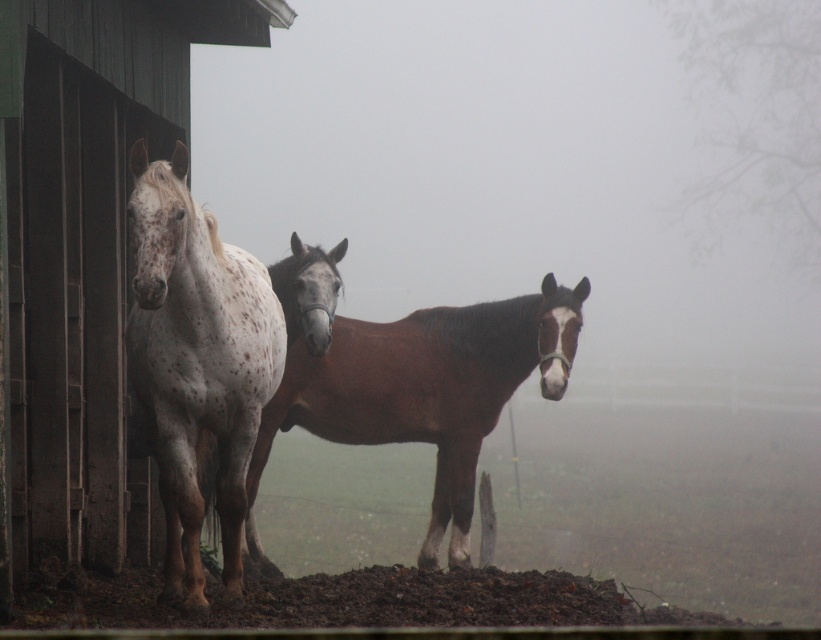
You are a farmer checking the weather conditions. You notice the speckled white horse at left and the foggy atmosphere at center. Which object is closer to you?

The foggy atmosphere at center is closer to you than the speckled white horse at left.

You are a photographer wanting to capture the speckled white horse at center in the rural scene. Considering the foggy atmosphere at center, will the horse appear more or less obscured compared to the barn in the background?

The foggy atmosphere at center has a greater width than the speckled white horse at center, so the horse will appear more obscured by the fog compared to the barn in the background.

You are a photographer trying to capture the speckled white horse at left against the foggy atmosphere at center. Considering their sizes, which one will appear more prominent in the photo?

The foggy atmosphere at center has a larger size compared to the speckled white horse at left, so it will appear more prominent in the photo.